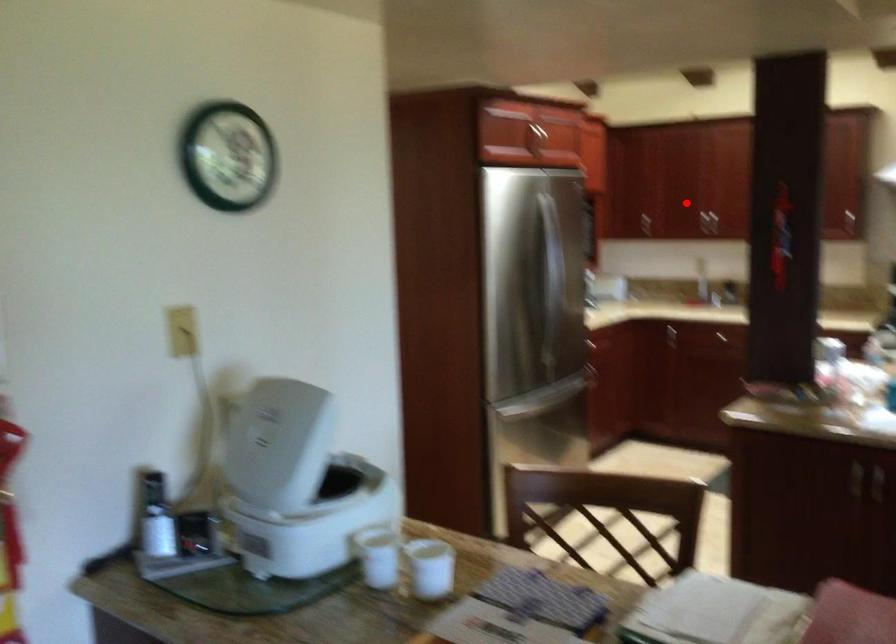
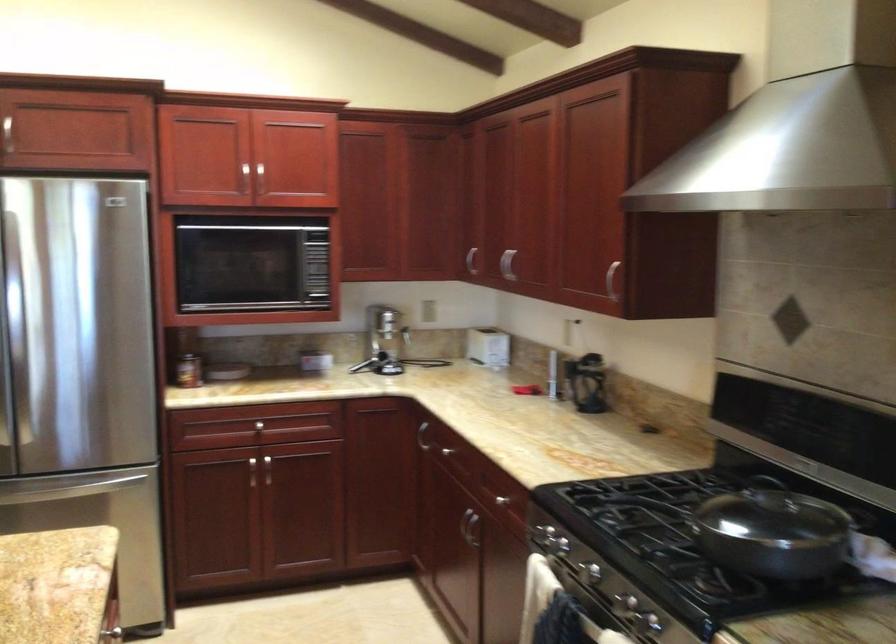
Where in the second image is the point corresponding to the highlighted location from the first image?

(506, 263)